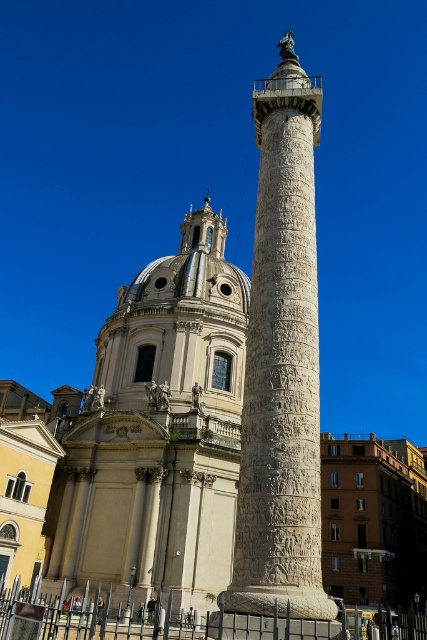
You are an architect analyzing the spatial relationship between the two central structures in the image. Given that the white marble dome at center and the white stone column at center are both central to the composition, which one appears to take up more visual space in the scene?

The white stone column at center occupies more visual space than the white marble dome at center, as stated in the description that the white marble dome at center occupies less space than the white stone column at center.

What are the coordinates of the white marble dome at center in the image?

The white marble dome at center is located at coordinates (157,429).